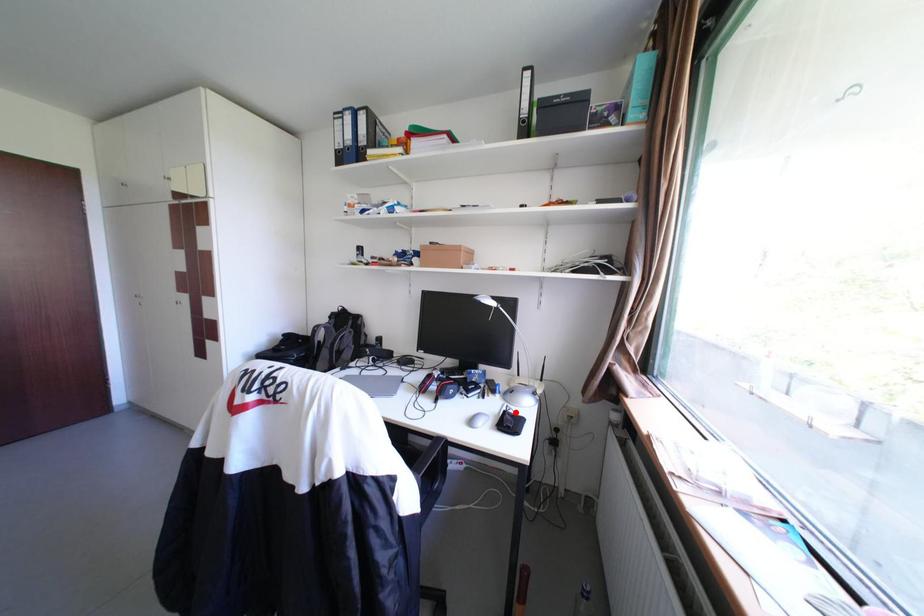
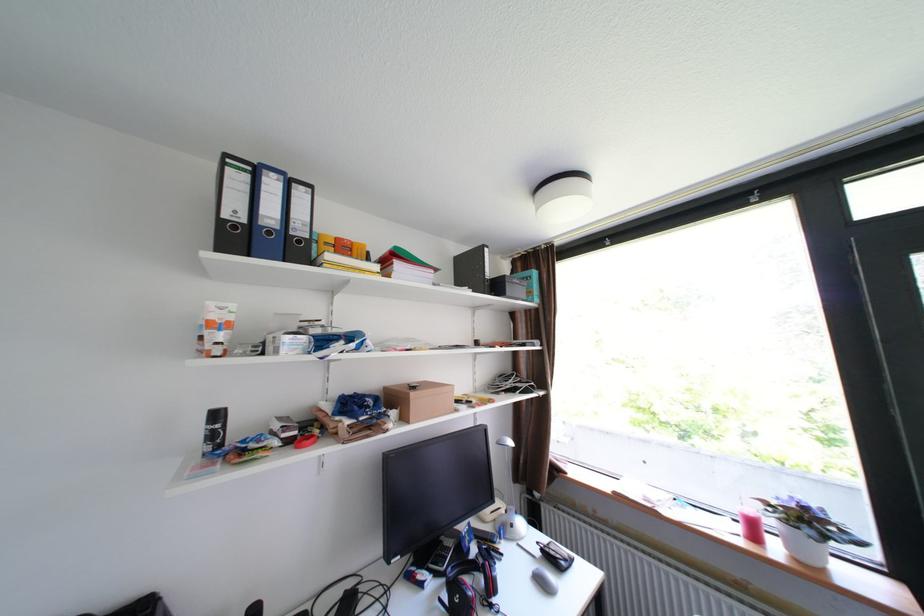
In the second image, find the point that corresponds to the highlighted location in the first image.

(553, 551)